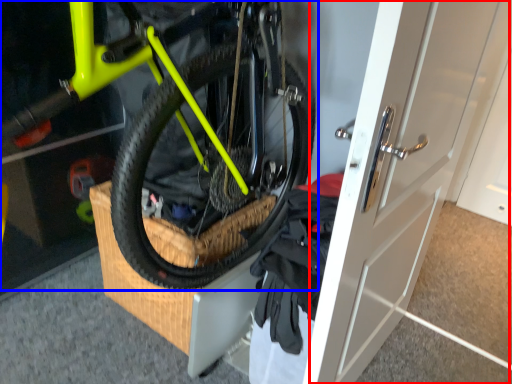
Question: Which object is further to the camera taking this photo, door (highlighted by a red box) or bicycle (highlighted by a blue box)?

Choices:
 (A) door
 (B) bicycle

Answer: (A)